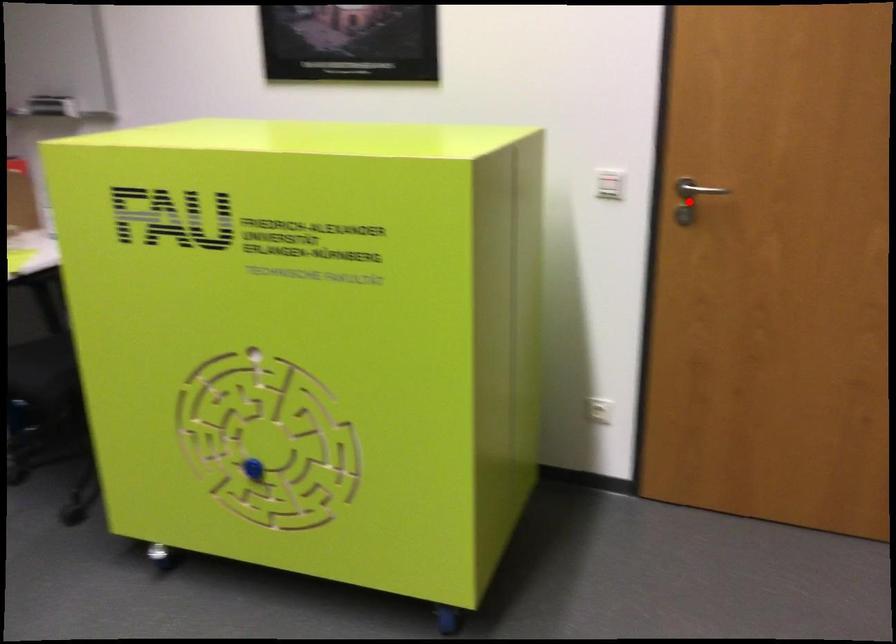
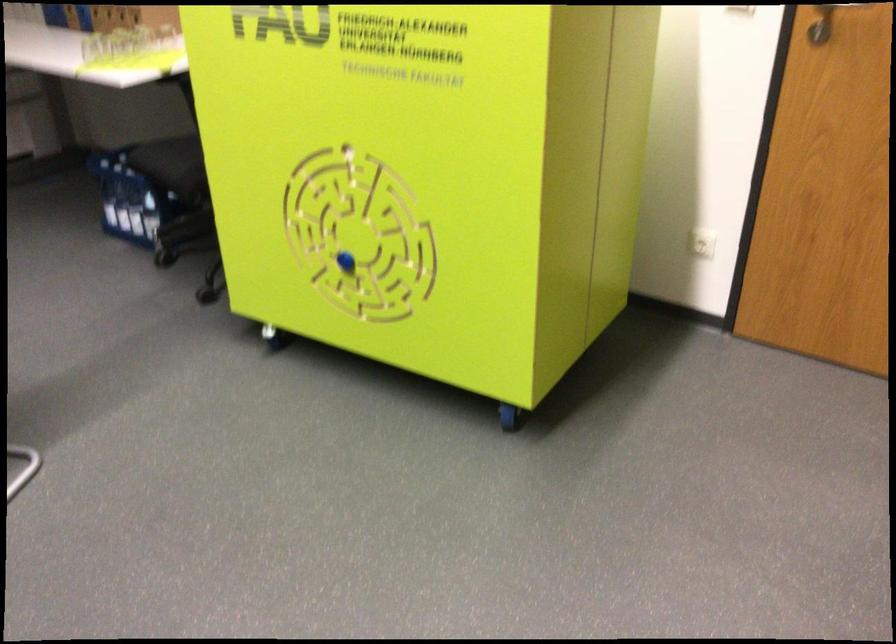
Where in the second image is the point corresponding to the highlighted location from the first image?

(821, 24)